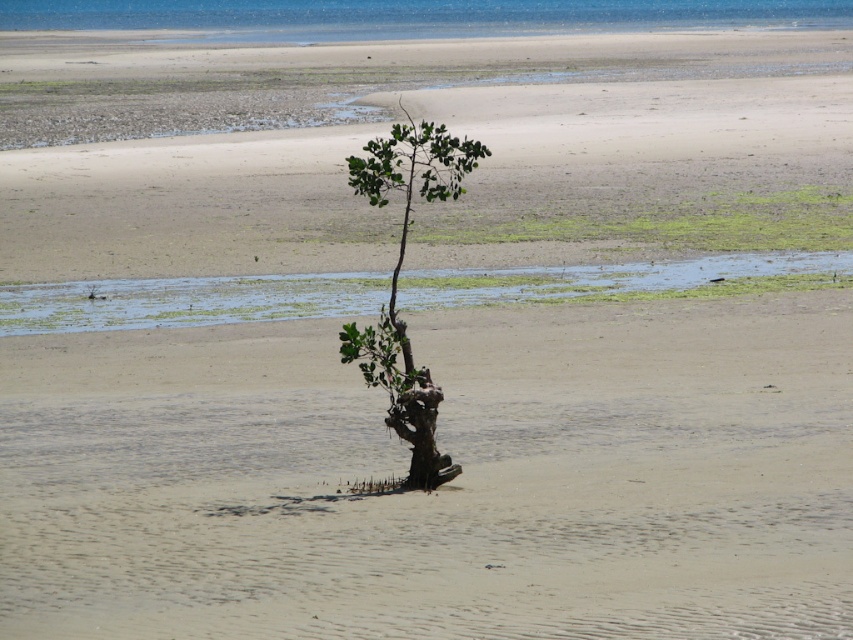
Can you confirm if blue water at upper center is positioned to the right of brown rough tree trunk at center?

Incorrect, blue water at upper center is not on the right side of brown rough tree trunk at center.

Is blue water at upper center above brown rough tree trunk at center?

Yes.

Does point (241, 33) come in front of point (421, 440)?

No, it is not.

The width and height of the screenshot is (853, 640). I want to click on blue water at upper center, so click(413, 17).

Which is more to the left, blue water at upper center or green leafy tree at center?

From the viewer's perspective, blue water at upper center appears more on the left side.

Does blue water at upper center have a greater height compared to green leafy tree at center?

In fact, blue water at upper center may be shorter than green leafy tree at center.

Is point (688, 20) closer to camera compared to point (401, 176)?

No, (688, 20) is further to viewer.

I want to click on blue water at upper center, so click(x=413, y=17).

You are a GUI agent. You are given a task and a screenshot of the screen. Output one action in this format:
    pyautogui.click(x=<x>, y=<y>)
    Task: Click on the green leafy tree at center
    
    Given the screenshot: What is the action you would take?
    pyautogui.click(x=397, y=282)

Does green leafy tree at center come in front of brown rough tree trunk at center?

Yes, green leafy tree at center is closer to the viewer.

Image resolution: width=853 pixels, height=640 pixels. I want to click on green leafy tree at center, so click(397, 282).